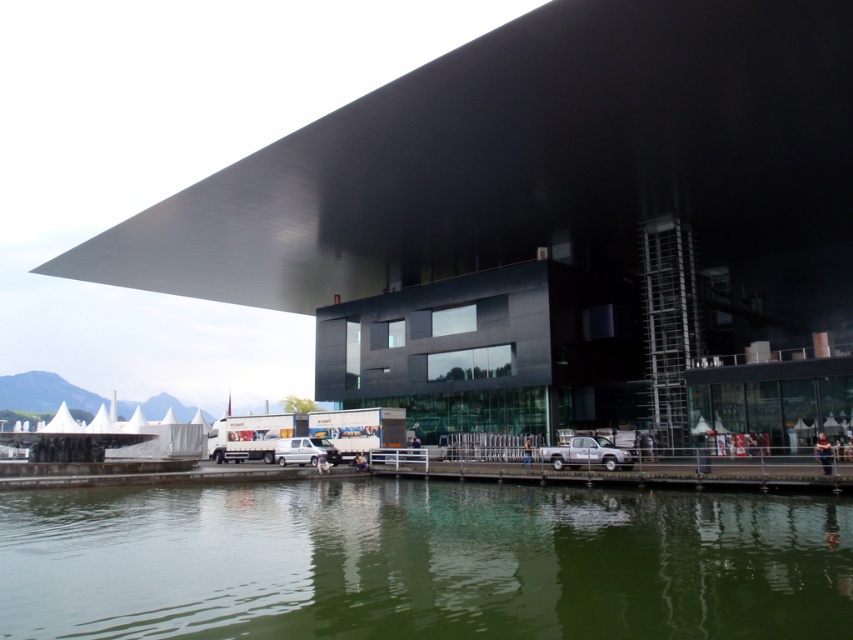
You are standing at the point labeled as point (421, 561) in the image. Based on the scene description, what do you see around you?

You are standing in the green liquid water at lower center.

You are a delivery driver who needs to park your vehicle on the dock. The dock has limited space. Based on the image, which object occupies more area on the dock, the green liquid water at lower center or the metallic dock at lower center?

The green liquid water at lower center occupies more area on the dock than the metallic dock at lower center.

You are a delivery person who needs to park your vehicle on the dock. The dock can only support vehicles up to its width. Given that your vehicle is as wide as the dock, can you safely park it on the metallic dock at lower center without overhanging into the green liquid water at lower center?

The green liquid water at lower center is wider than the metallic dock at lower center. Since your vehicle is as wide as the dock, it should fit without overhanging into the water.